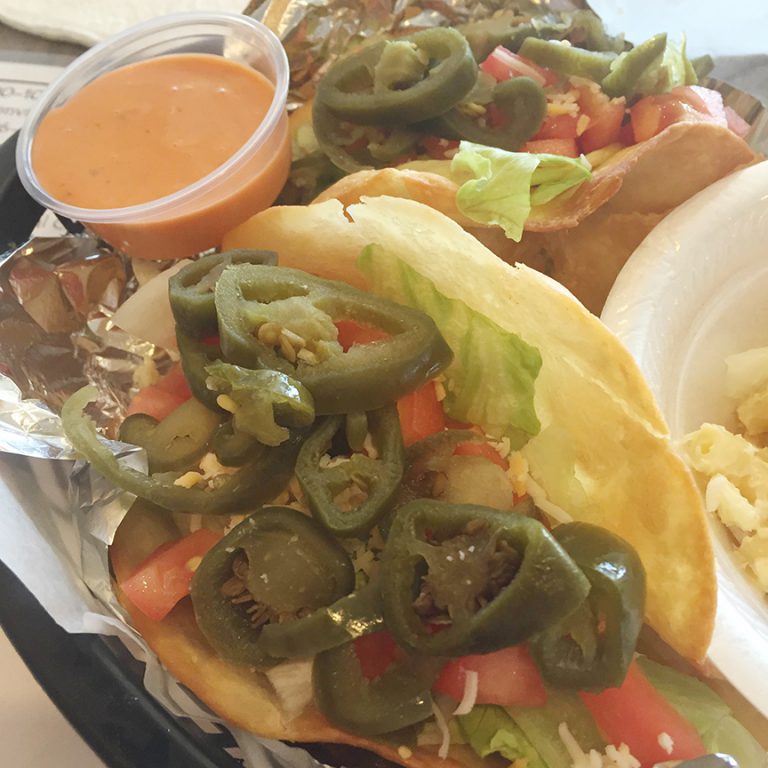
You are a GUI agent. You are given a task and a screenshot of the screen. Output one action in this format:
    pyautogui.click(x=<x>, y=<y>)
    Task: Click on the tray
    The width and height of the screenshot is (768, 768).
    Given the screenshot: What is the action you would take?
    pyautogui.click(x=137, y=694)